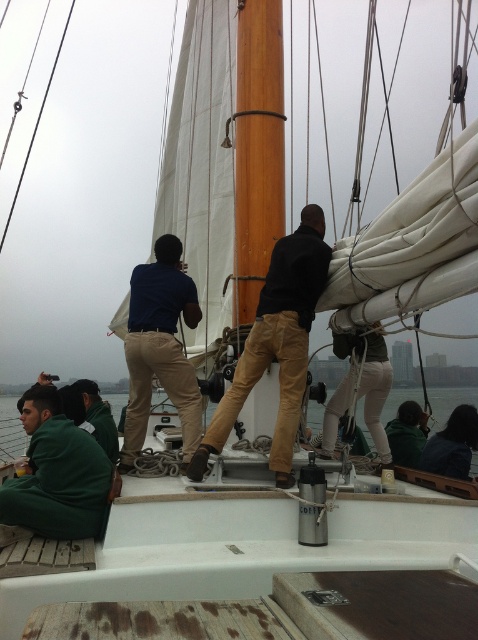
In the scene shown: You are a photographer on the deck of the sailboat. You want to take a photo of both the dark brown leather pants at center and the matte blue shirt at center in the same frame. The camera you are using has a minimum focus distance of 30 inches. Will you be able to capture both subjects clearly in the photo?

The dark brown leather pants at center and the matte blue shirt at center are 30.85 inches apart. Since the minimum focus distance is 30 inches, the photographer can capture both subjects clearly as the distance between them is just over the required minimum.